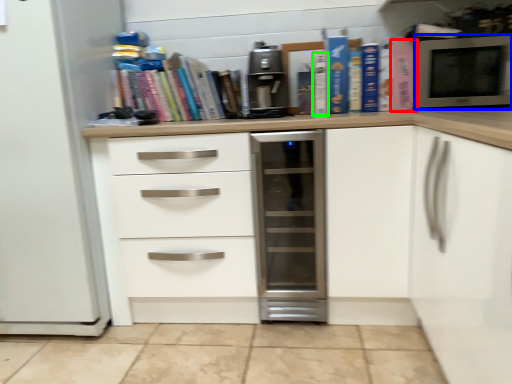
Question: Which is farther away from paperback book (highlighted by a red box)? microwave oven (highlighted by a blue box) or paperback book (highlighted by a green box)?

Choices:
 (A) microwave oven
 (B) paperback book

Answer: (B)